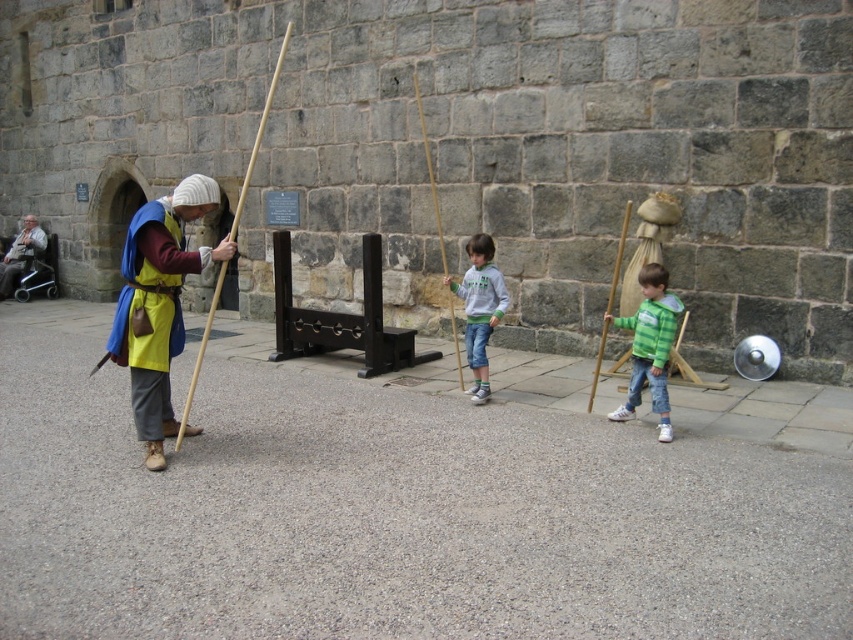
You are an observer standing in front of the stone wall. You see a gray fleece sweater at center and a wooden stick at right. Which object is closer to your right side?

The wooden stick at right is closer to your right side because it is positioned to the right of the gray fleece sweater at center.